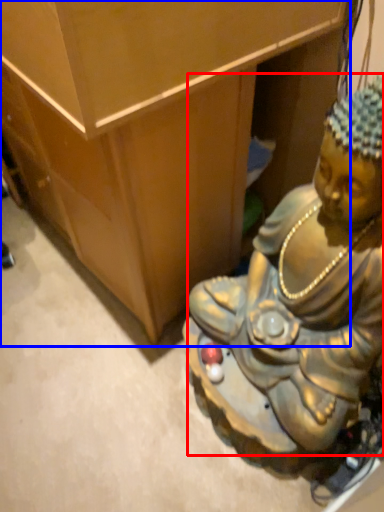
Question: Among these objects, which one is nearest to the camera, person (highlighted by a red box) or furniture (highlighted by a blue box)?

Choices:
 (A) person
 (B) furniture

Answer: (A)